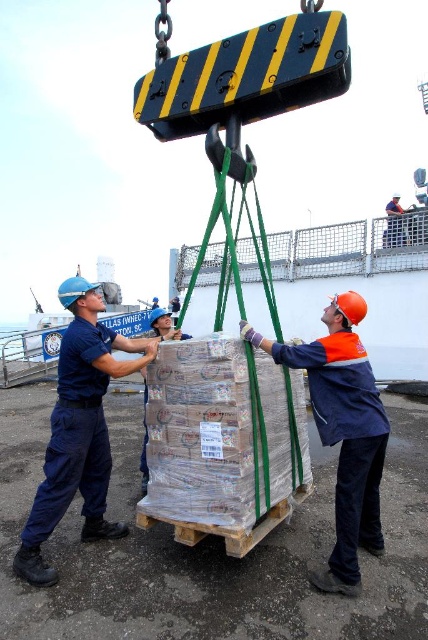
You are observing the workers on the dock. Which object, the blue uniform at center or the orange hard hat at center, has a smaller width?

The blue uniform at center is thinner than the orange hard hat at center, so the blue uniform at center has a smaller width.

You are observing the workers on the dock. Which object, the blue uniform at center or the orange hard hat at upper center, is positioned higher from the ground?

The orange hard hat at upper center is positioned higher from the ground than the blue uniform at center.